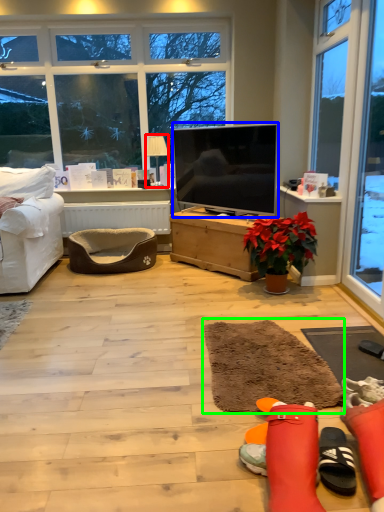
Question: Which object is positioned closest to lamp (highlighted by a red box)? Select from television (highlighted by a blue box) and flat (highlighted by a green box).

Choices:
 (A) television
 (B) flat

Answer: (A)